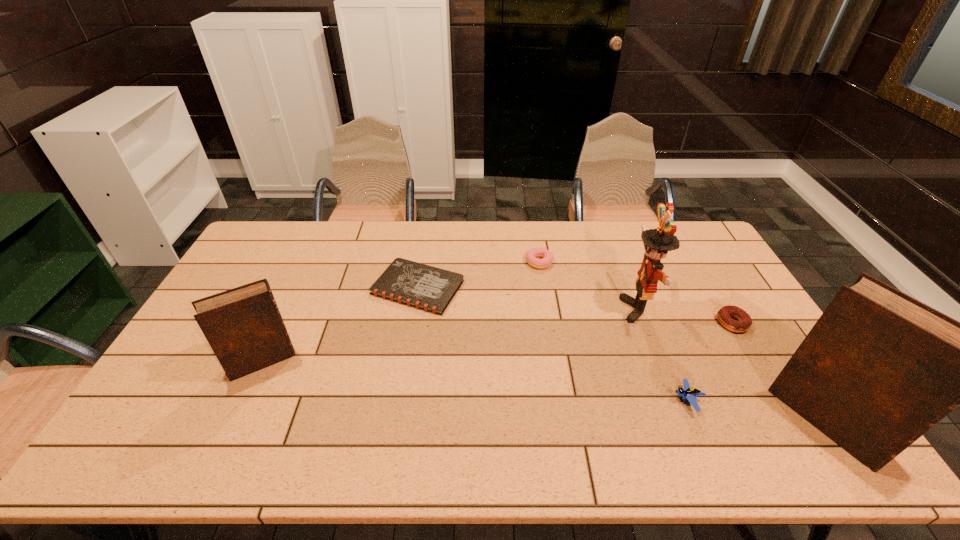
At what (x,y) coordinates should I click in order to perform the action: click on free space that satisfies the following two spatial constraints: 1. on the front-facing side of the taller Bible; 2. on the right side of the nutcracker. Please return your answer as a coordinate pair (x, y). This screenshot has height=540, width=960. Looking at the image, I should click on (681, 421).